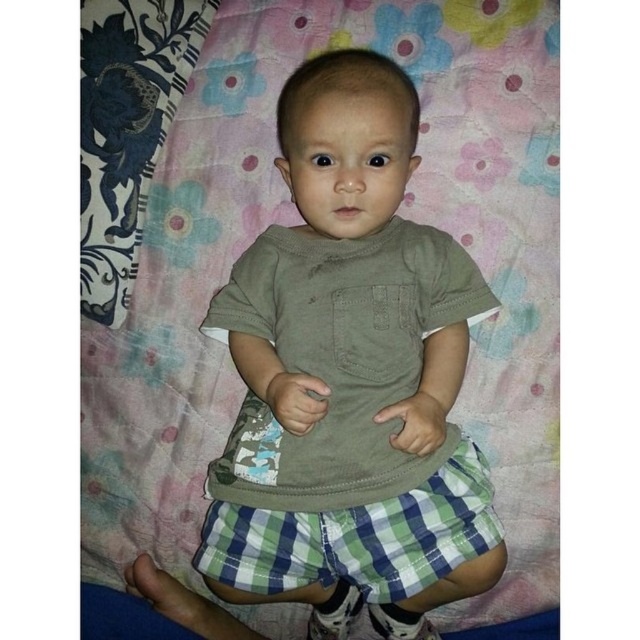
Is floral fabric blanket at upper center to the left of green checkered shorts at center from the viewer's perspective?

Indeed, floral fabric blanket at upper center is positioned on the left side of green checkered shorts at center.

Between floral fabric blanket at upper center and green checkered shorts at center, which one is positioned higher?

floral fabric blanket at upper center is higher up.

I want to click on floral fabric blanket at upper center, so click(x=298, y=221).

Find the location of a particular element. The width and height of the screenshot is (640, 640). floral fabric blanket at upper center is located at coordinates (298, 221).